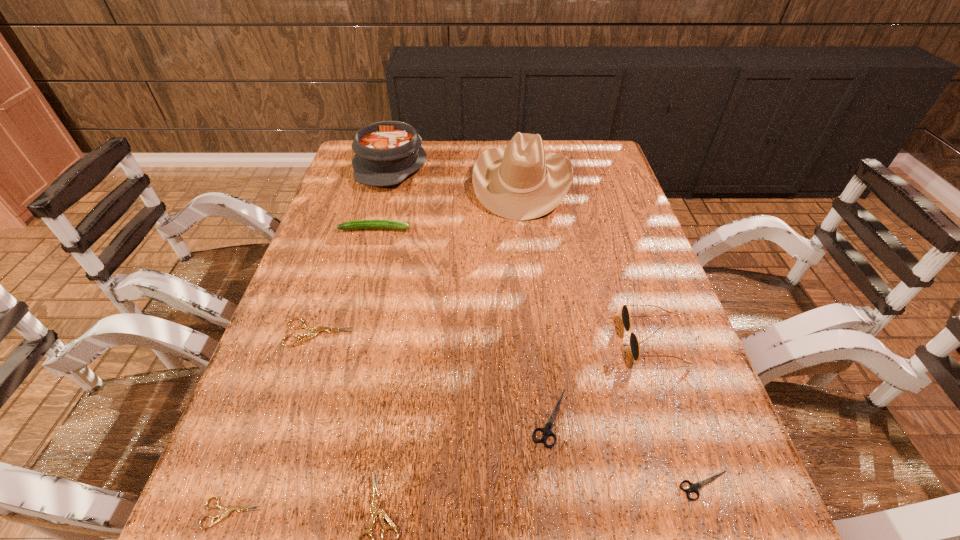
Identify which shears is the third closest to the second tallest object. Please provide its 2D coordinates. Your answer should be formatted as a tuple, i.e. [(x, y)], where the tuple contains the x and y coordinates of a point satisfying the conditions above.

[(375, 510)]

Where is `shears that can be found as the second closest to the rightmost beige shears`? The width and height of the screenshot is (960, 540). shears that can be found as the second closest to the rightmost beige shears is located at coordinates (547, 431).

This screenshot has height=540, width=960. In order to click on beige shears that is the closest to the zucchini in this screenshot , I will do `click(316, 330)`.

What are the coordinates of `the second closest beige shears to the brown cowboy hat` in the screenshot? It's located at point(375,510).

Where is `vacant point that satisfies the following two spatial constraints: 1. on the back side of the shortest shears; 2. on the left side of the casserole`? vacant point that satisfies the following two spatial constraints: 1. on the back side of the shortest shears; 2. on the left side of the casserole is located at coordinates (359, 165).

The width and height of the screenshot is (960, 540). In order to click on free space that satisfies the following two spatial constraints: 1. on the back side of the biggest beige shears; 2. on the left side of the cowboy hat in this screenshot , I will do `click(368, 183)`.